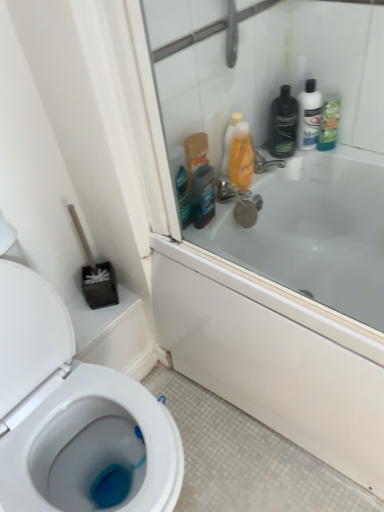
Question: From the image's perspective, would you say green matte bottle at upper right, which is counted as the first cleaning product, starting from the right, is positioned over black matte bottle at upper right, the 2th toiletry from the right?

Choices:
 (A) yes
 (B) no

Answer: (B)

Question: Is green matte bottle at upper right, which is counted as the second cleaning product, starting from the left, to the left of black matte bottle at upper right, the 2th toiletry from the right, from the viewer's perspective?

Choices:
 (A) no
 (B) yes

Answer: (A)

Question: Is green matte bottle at upper right, which is counted as the second cleaning product, starting from the left, taller than black matte bottle at upper right, the 2th toiletry from the right?

Choices:
 (A) no
 (B) yes

Answer: (A)

Question: Is green matte bottle at upper right, which is counted as the second cleaning product, starting from the left, beside black matte bottle at upper right, the 2th toiletry from the right?

Choices:
 (A) yes
 (B) no

Answer: (B)

Question: From the image's perspective, is green matte bottle at upper right, which is counted as the first cleaning product, starting from the right, below black matte bottle at upper right, the 1th toiletry when ordered from left to right?

Choices:
 (A) no
 (B) yes

Answer: (B)

Question: Is green matte bottle at upper right, which is counted as the second cleaning product, starting from the left, behind black matte bottle at upper right, the 2th toiletry from the right?

Choices:
 (A) yes
 (B) no

Answer: (A)

Question: Considering the relative sizes of translucent orange bottle at upper right, the 1th cleaning product in the left-to-right sequence, and green matte bottle at upper right, which is counted as the second cleaning product, starting from the left, in the image provided, is translucent orange bottle at upper right, the 1th cleaning product in the left-to-right sequence, bigger than green matte bottle at upper right, which is counted as the second cleaning product, starting from the left,?

Choices:
 (A) yes
 (B) no

Answer: (A)

Question: Is translucent orange bottle at upper right, the 1th cleaning product in the left-to-right sequence, shorter than green matte bottle at upper right, which is counted as the second cleaning product, starting from the left?

Choices:
 (A) yes
 (B) no

Answer: (B)

Question: Is translucent orange bottle at upper right, the second cleaning product viewed from the right, at the left side of green matte bottle at upper right, which is counted as the first cleaning product, starting from the right?

Choices:
 (A) no
 (B) yes

Answer: (B)

Question: Is translucent orange bottle at upper right, the 1th cleaning product in the left-to-right sequence, next to green matte bottle at upper right, which is counted as the second cleaning product, starting from the left, and touching it?

Choices:
 (A) yes
 (B) no

Answer: (B)

Question: From the image's perspective, is translucent orange bottle at upper right, the second cleaning product viewed from the right, on green matte bottle at upper right, which is counted as the first cleaning product, starting from the right?

Choices:
 (A) no
 (B) yes

Answer: (A)

Question: Is translucent orange bottle at upper right, the second cleaning product viewed from the right, turned away from green matte bottle at upper right, which is counted as the first cleaning product, starting from the right?

Choices:
 (A) yes
 (B) no

Answer: (B)

Question: Can you confirm if dark brown plastic mouthwash at upper right is smaller than translucent orange bottle at upper right, the second cleaning product viewed from the right?

Choices:
 (A) yes
 (B) no

Answer: (A)